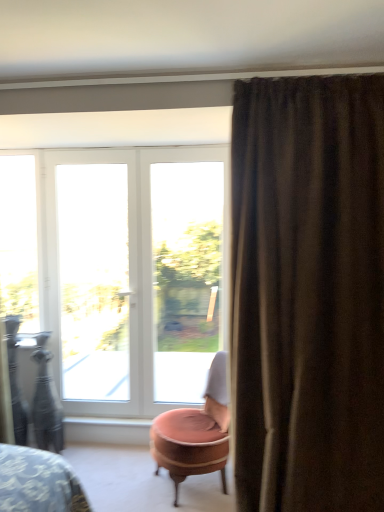
The height and width of the screenshot is (512, 384). Identify the location of free location above white glossy window sill at lower center (from a real-world perspective). (111, 420).